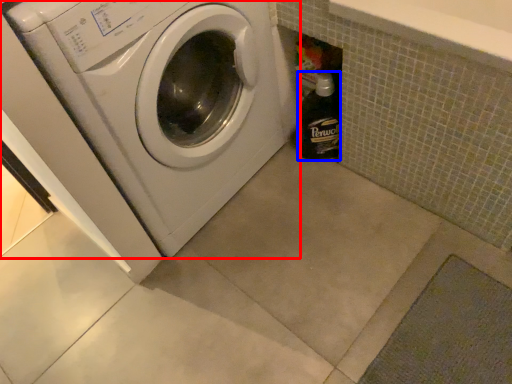
Question: Which object appears closest to the camera in this image, washing machine (highlighted by a red box) or bottle (highlighted by a blue box)?

Choices:
 (A) washing machine
 (B) bottle

Answer: (A)